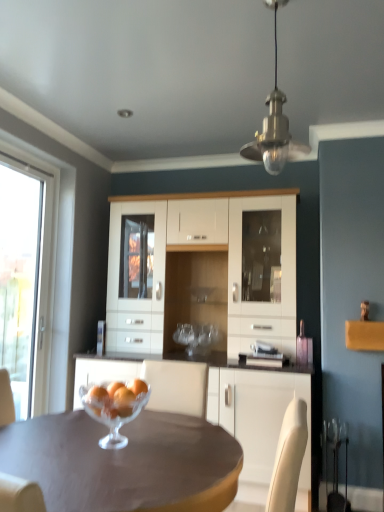
Identify the location of vacant space behind clear glass bowl at center. (152, 420).